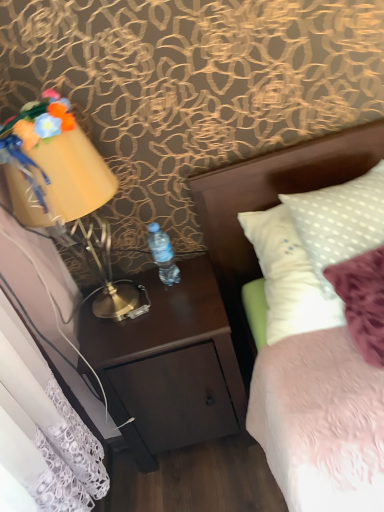
The height and width of the screenshot is (512, 384). Identify the location of vacant area situated below matte yellow lampshade at left (from a real-world perspective). (119, 304).